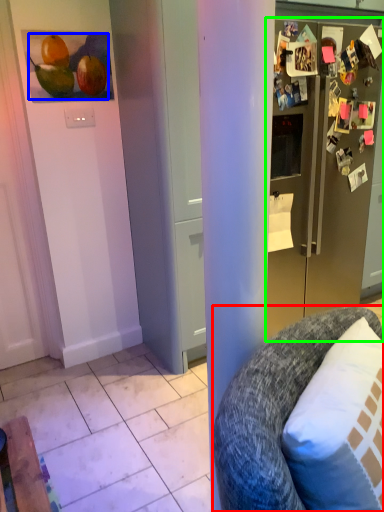
Question: Which is nearer to the chair (highlighted by a red box)? fruit (highlighted by a blue box) or refrigerator (highlighted by a green box).

Choices:
 (A) fruit
 (B) refrigerator

Answer: (B)